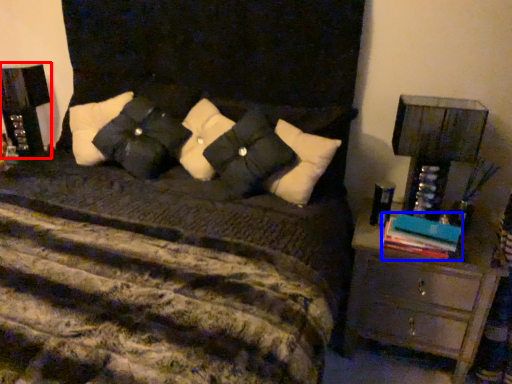
Question: Which point is closer to the camera, nightstand (highlighted by a red box) or book (highlighted by a blue box)?

Choices:
 (A) nightstand
 (B) book

Answer: (B)